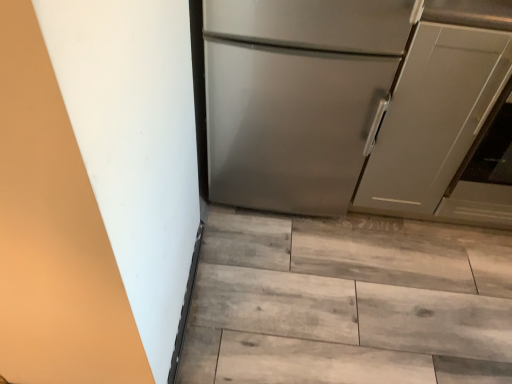
Question: Is wooden floor at lower center positioned before satin silver refrigerator at center?

Choices:
 (A) no
 (B) yes

Answer: (A)

Question: From a real-world perspective, is wooden floor at lower center physically above satin silver refrigerator at center?

Choices:
 (A) no
 (B) yes

Answer: (A)

Question: From a real-world perspective, is wooden floor at lower center positioned under satin silver refrigerator at center based on gravity?

Choices:
 (A) yes
 (B) no

Answer: (A)

Question: Does wooden floor at lower center have a smaller size compared to satin silver refrigerator at center?

Choices:
 (A) no
 (B) yes

Answer: (B)

Question: Can you confirm if wooden floor at lower center is positioned to the right of satin silver refrigerator at center?

Choices:
 (A) no
 (B) yes

Answer: (B)

Question: From the image's perspective, is satin silver refrigerator at center located above or below matte gray cabinet at right?

Choices:
 (A) below
 (B) above

Answer: (B)

Question: In terms of height, does satin silver refrigerator at center look taller or shorter compared to matte gray cabinet at right?

Choices:
 (A) short
 (B) tall

Answer: (B)

Question: Looking at the image, does satin silver refrigerator at center seem bigger or smaller compared to matte gray cabinet at right?

Choices:
 (A) big
 (B) small

Answer: (A)

Question: Is point (421, 119) closer or farther from the camera than point (420, 105)?

Choices:
 (A) closer
 (B) farther

Answer: (B)

Question: Is wooden floor at lower center to the left or to the right of satin silver refrigerator at center in the image?

Choices:
 (A) right
 (B) left

Answer: (A)

Question: Is wooden floor at lower center wider or thinner than satin silver refrigerator at center?

Choices:
 (A) thin
 (B) wide

Answer: (B)

Question: From a real-world perspective, relative to satin silver refrigerator at center, is wooden floor at lower center vertically above or below?

Choices:
 (A) below
 (B) above

Answer: (A)

Question: Considering the positions of wooden floor at lower center and satin silver refrigerator at center in the image, is wooden floor at lower center taller or shorter than satin silver refrigerator at center?

Choices:
 (A) short
 (B) tall

Answer: (A)

Question: From a real-world perspective, relative to satin silver refrigerator at center, is matte gray cabinet at right vertically above or below?

Choices:
 (A) below
 (B) above

Answer: (A)

Question: Which is correct: matte gray cabinet at right is inside satin silver refrigerator at center, or outside of it?

Choices:
 (A) outside
 (B) inside

Answer: (A)